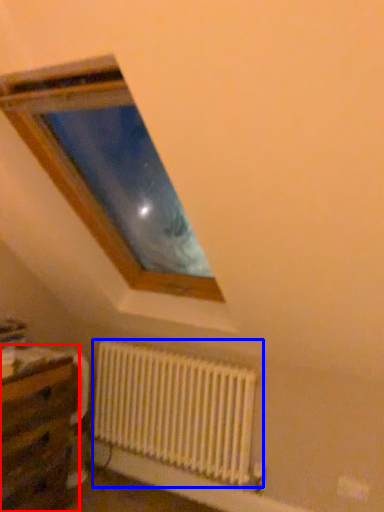
Question: Among these objects, which one is nearest to the camera, table (highlighted by a red box) or radiator (highlighted by a blue box)?

Choices:
 (A) table
 (B) radiator

Answer: (A)